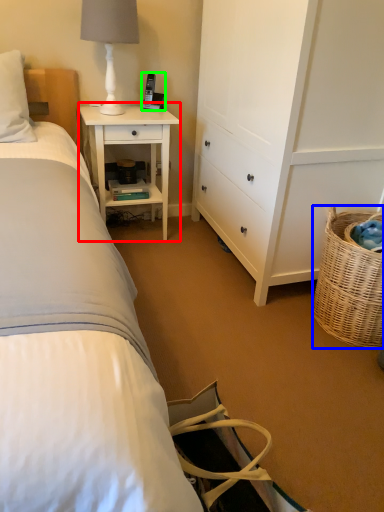
Question: Which object is the farthest from nightstand (highlighted by a red box)? Choose among these: picnic basket (highlighted by a blue box) or corded phone (highlighted by a green box).

Choices:
 (A) picnic basket
 (B) corded phone

Answer: (A)